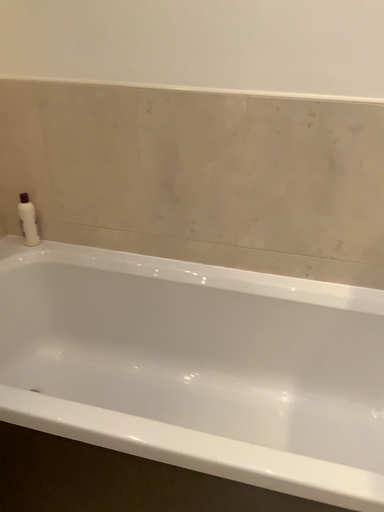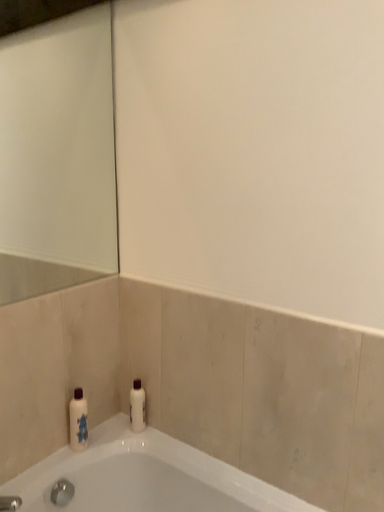
Question: How did the camera likely rotate when shooting the video?

Choices:
 (A) rotated right
 (B) rotated left

Answer: (B)